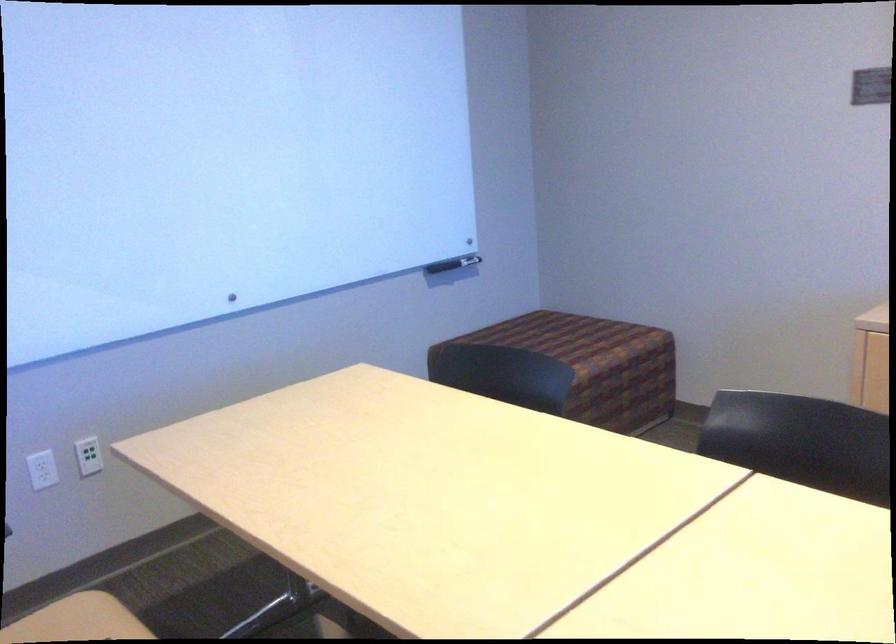
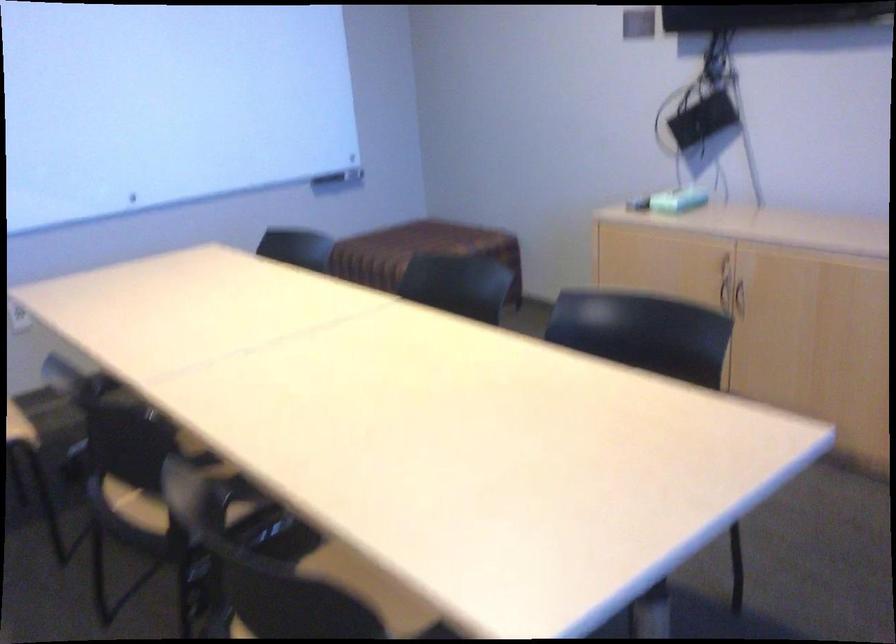
Locate, in the second image, the point that corresponds to pixel 462 267 in the first image.

(339, 178)